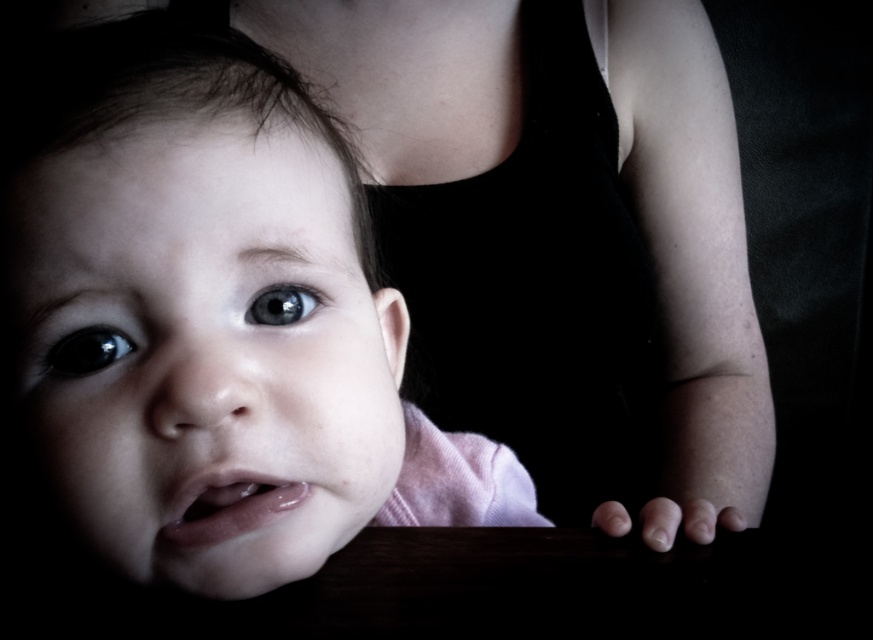
You are a photographer adjusting the focus on your camera. You have two points to focus on in the image, point (x=148, y=342) and point (x=722, y=310). Which point is closer to the camera?

Point (x=148, y=342) is in front of point (x=722, y=310), so it is closer to the camera.